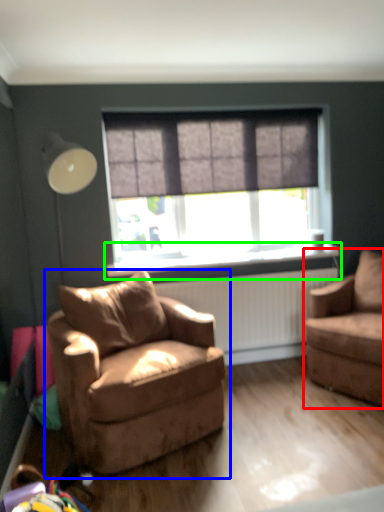
Question: Which object is the closest to the chair (highlighted by a red box)? Choose among these: chair (highlighted by a blue box) or window sill (highlighted by a green box).

Choices:
 (A) chair
 (B) window sill

Answer: (B)